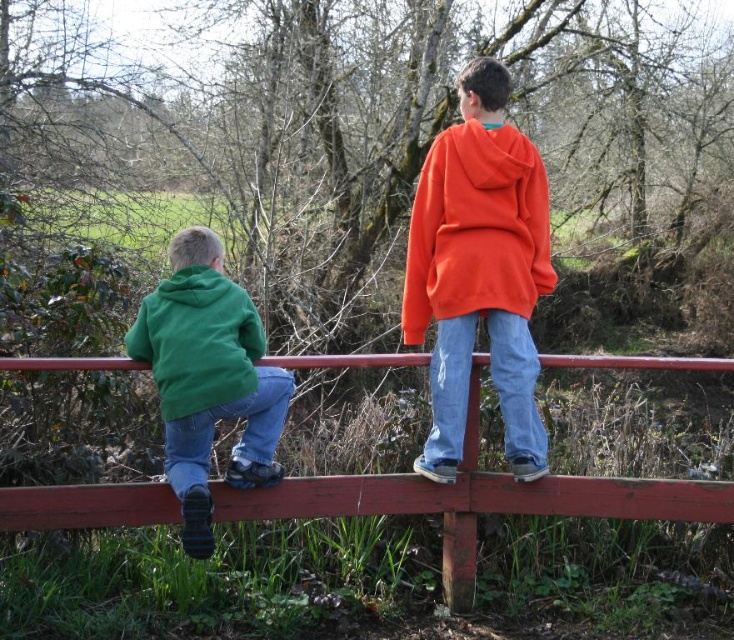
Can you confirm if orange fleece jacket at upper center is shorter than smooth wooden fence at center?

No, orange fleece jacket at upper center is not shorter than smooth wooden fence at center.

Does orange fleece jacket at upper center appear under smooth wooden fence at center?

No.

Locate an element on the screen. This screenshot has height=640, width=734. orange fleece jacket at upper center is located at coordinates (479, 272).

Who is higher up, orange fleece jacket at upper center or green matte hoodie at left?

Positioned higher is orange fleece jacket at upper center.

Does point (424, 225) come in front of point (181, 433)?

No, (424, 225) is further to viewer.

Is point (432, 195) positioned after point (199, 552)?

Yes, point (432, 195) is farther from viewer.

The width and height of the screenshot is (734, 640). I want to click on orange fleece jacket at upper center, so click(x=479, y=272).

Does point (150, 486) come in front of point (186, 374)?

No, it is not.

You are a GUI agent. You are given a task and a screenshot of the screen. Output one action in this format:
    pyautogui.click(x=<x>, y=<y>)
    Task: Click on the smooth wooden fence at center
    This screenshot has height=640, width=734.
    Given the screenshot: What is the action you would take?
    pyautogui.click(x=476, y=500)